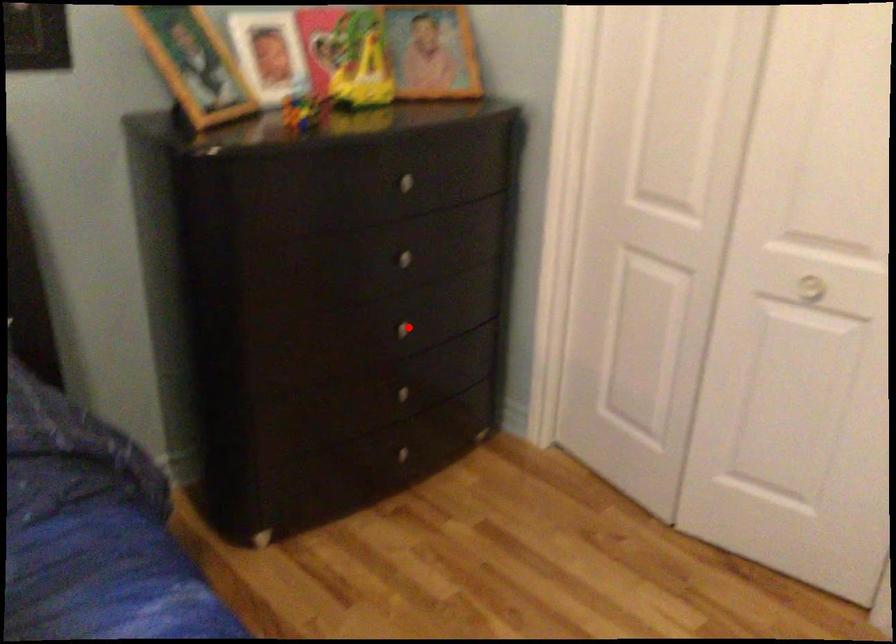
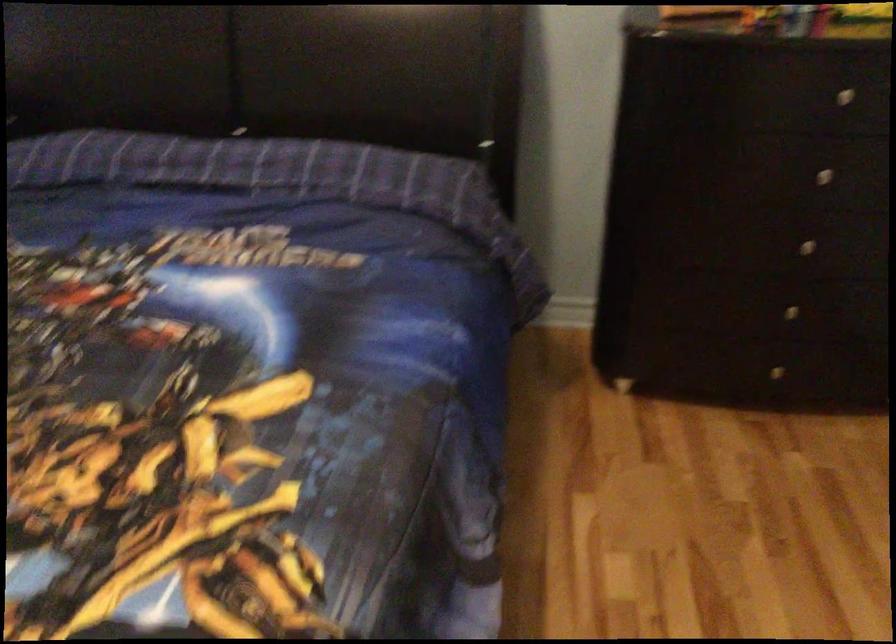
The point at the highlighted location is marked in the first image. Where is the corresponding point in the second image?

(805, 245)